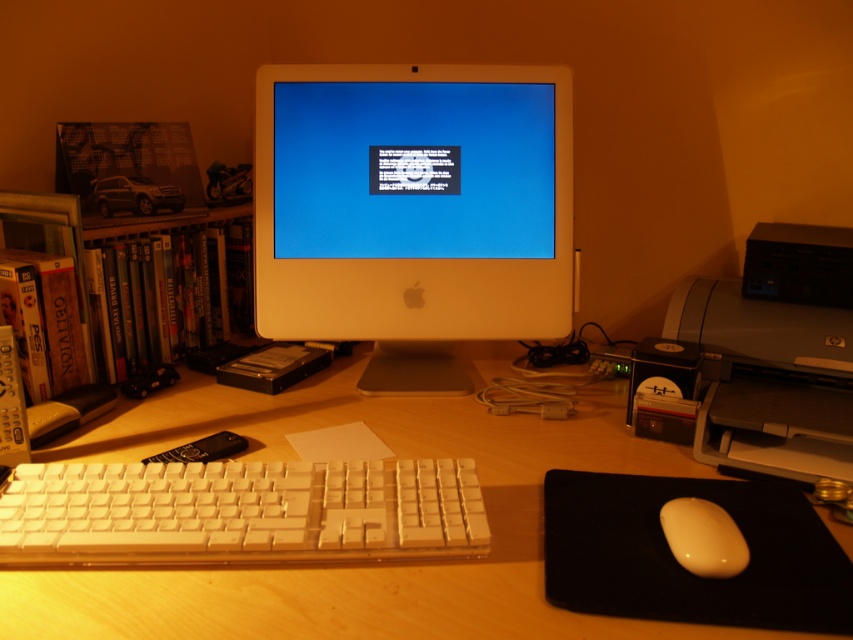
Question: Which point is farther to the camera?

Choices:
 (A) matte gray printer at right
 (B) white plastic monitor at center
 (C) shiny plastic dvds at left

Answer: (B)

Question: Considering the relative positions of white plastic keyboard at lower left and matte gray printer at right in the image provided, where is white plastic keyboard at lower left located with respect to matte gray printer at right?

Choices:
 (A) left
 (B) right

Answer: (A)

Question: Which is farther from the matte yellow mouse at lower right?

Choices:
 (A) matte gray printer at right
 (B) white plastic monitor at center
 (C) wooden desk at center

Answer: (B)

Question: Does white plastic monitor at center have a greater width compared to shiny plastic dvds at left?

Choices:
 (A) yes
 (B) no

Answer: (A)

Question: Does white plastic monitor at center lie in front of matte yellow mouse at lower right?

Choices:
 (A) yes
 (B) no

Answer: (B)

Question: Which point is farther to the camera?

Choices:
 (A) (238, 275)
 (B) (321, 204)

Answer: (A)